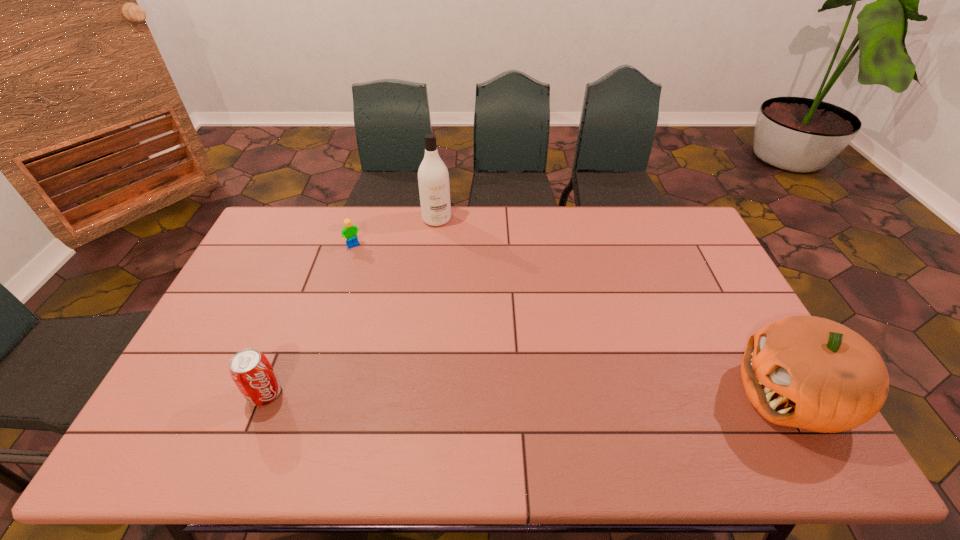
Image resolution: width=960 pixels, height=540 pixels. I want to click on blank space located 0.180m on the face of the rightmost object, so click(667, 395).

This screenshot has width=960, height=540. Find the location of `free location located 0.190m on the face of the rightmost object`. free location located 0.190m on the face of the rightmost object is located at coordinates (663, 395).

Identify the location of vacant space located 0.400m on the face of the third nearest object. (416, 322).

Where is `free space located on the face of the third nearest object`? This screenshot has width=960, height=540. free space located on the face of the third nearest object is located at coordinates pyautogui.click(x=392, y=293).

Locate an element on the screen. This screenshot has width=960, height=540. vacant area situated 0.330m on the face of the third nearest object is located at coordinates (404, 308).

Where is `vacant space located on the front-facing side of the second object from right to left`? The height and width of the screenshot is (540, 960). vacant space located on the front-facing side of the second object from right to left is located at coordinates (450, 267).

Locate an element on the screen. free space located 0.070m on the front-facing side of the second object from right to left is located at coordinates [443, 239].

You are a GUI agent. You are given a task and a screenshot of the screen. Output one action in this format:
    pyautogui.click(x=<x>, y=<y>)
    Task: Click on the blank space located 0.370m on the front-facing side of the second object from right to left
    
    Given the screenshot: What is the action you would take?
    pyautogui.click(x=460, y=299)

Find the location of `Lego present at the far edge`. Lego present at the far edge is located at coordinates (349, 232).

Identify the location of shampoo that is at the far edge. (433, 179).